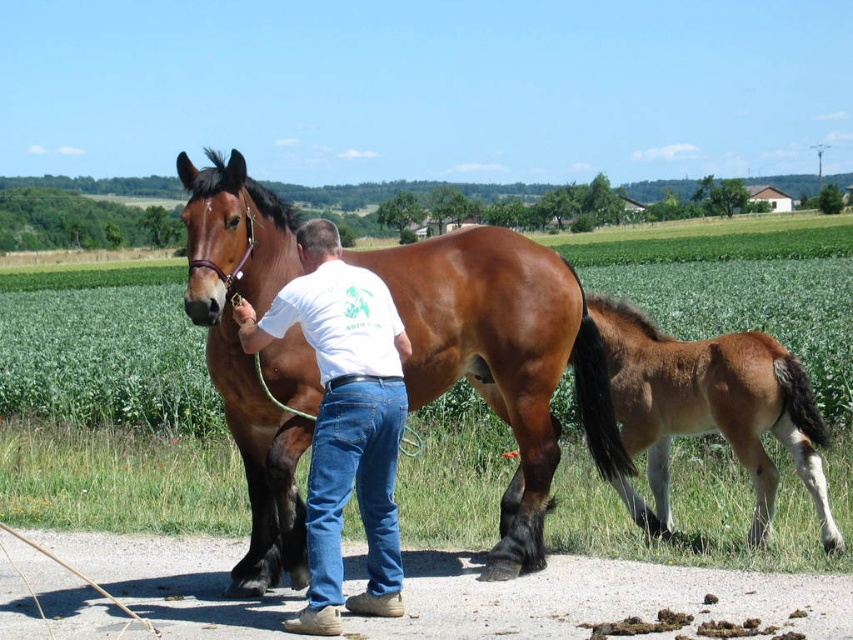
You are a delivery robot that needs to deliver a package to the person wearing the white cotton shirt at center. There is a brown glossy foal at lower right nearby. Can you safely approach the person without getting too close to the foal?

The distance between the white cotton shirt at center and the brown glossy foal at lower right is 2.01 meters. Since the robot needs to maintain a safe distance from the foal, it can safely approach the person as long as it stays within the 2.01 meters distance without encroaching closer than necessary.

You are a photographer standing in the field. You want to take a photo of the brown glossy horse at center and the brown glossy foal at lower right. Based on their positions, which animal should you focus on first if you want to capture both in the same frame without moving your camera?

The brown glossy horse at center is located below the brown glossy foal at lower right, so you should focus on the brown glossy foal at lower right first to ensure both are in the frame.

You are standing in the field and see two points in the scene. Which point is closer to you, point (x=312, y=349) or point (x=650, y=481)?

Point (x=312, y=349) is closer to the camera than point (x=650, y=481).